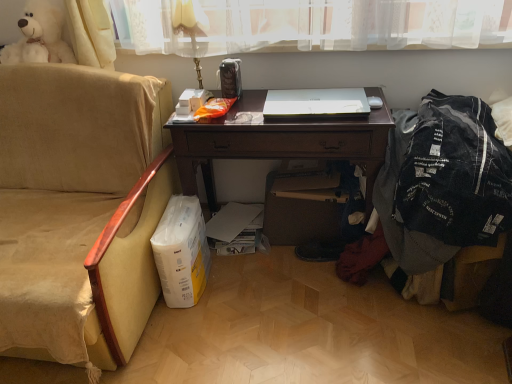
Where is `spots to the right of gold metallic table lamp at upper center`? This screenshot has width=512, height=384. spots to the right of gold metallic table lamp at upper center is located at coordinates (251, 99).